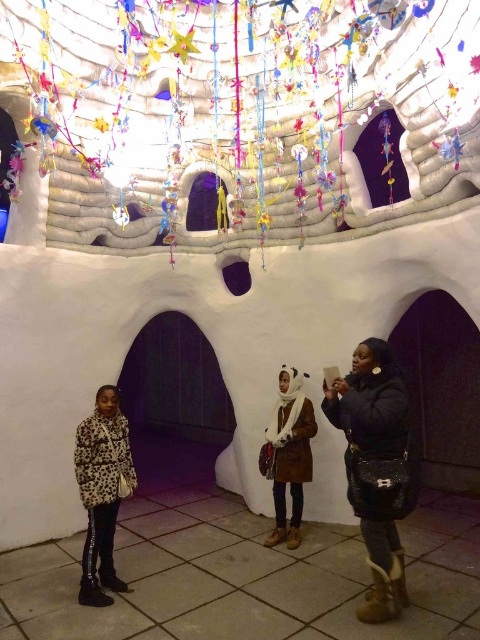
Question: Is leopard print coat at lower left positioned at the back of white fluffy scarf at center?

Choices:
 (A) no
 (B) yes

Answer: (A)

Question: Which point appears farthest from the camera in this image?

Choices:
 (A) (276, 416)
 (B) (368, 524)
 (C) (93, 518)

Answer: (A)

Question: Where is black quilted purse at lower right located in relation to leopard print coat at lower left in the image?

Choices:
 (A) above
 (B) below

Answer: (A)

Question: Which point is closer to the camera?

Choices:
 (A) (360, 451)
 (B) (287, 400)
 (C) (84, 440)

Answer: (A)

Question: Estimate the real-world distances between objects in this image. Which object is farther from the leopard print coat at lower left?

Choices:
 (A) black quilted purse at lower right
 (B) white fluffy scarf at center

Answer: (A)

Question: Is leopard print coat at lower left further to camera compared to white fluffy scarf at center?

Choices:
 (A) yes
 (B) no

Answer: (B)